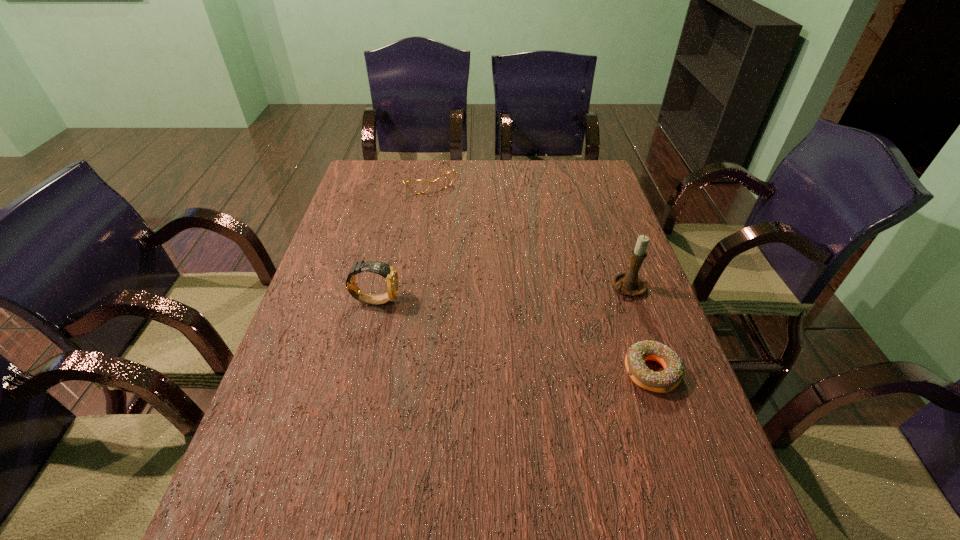
Locate an element on the screen. Image resolution: width=960 pixels, height=540 pixels. vacant spot on the desktop that is between the third shortest object and the doughnut and is positioned on the front-facing side of the spectacles is located at coordinates (539, 342).

Identify the location of vacant space on the desktop that is between the watch and the nearest object and is positioned on the side of the tallest object with the handle. (523, 339).